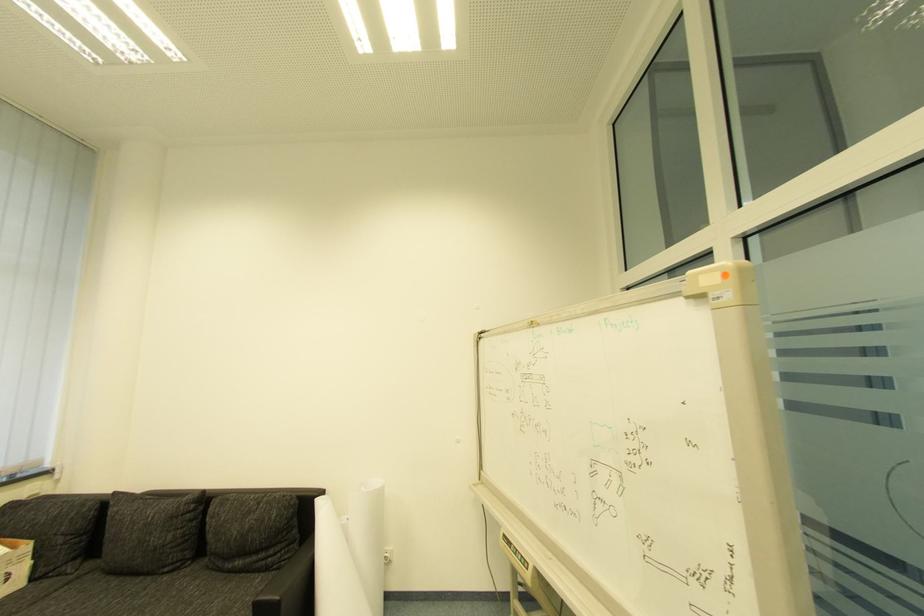
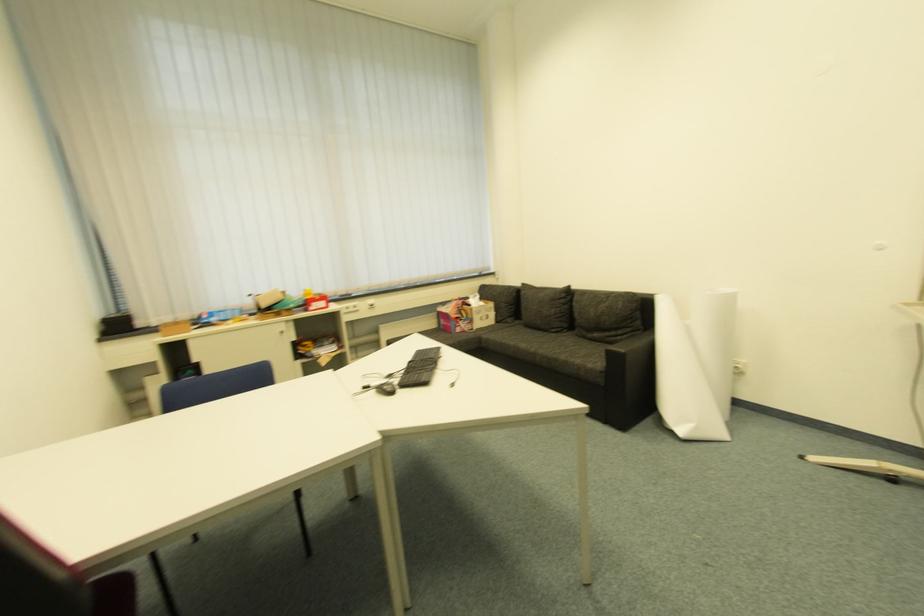
The first image is from the beginning of the video and the second image is from the end. How did the camera likely rotate when shooting the video?

The camera rotated toward left-down.